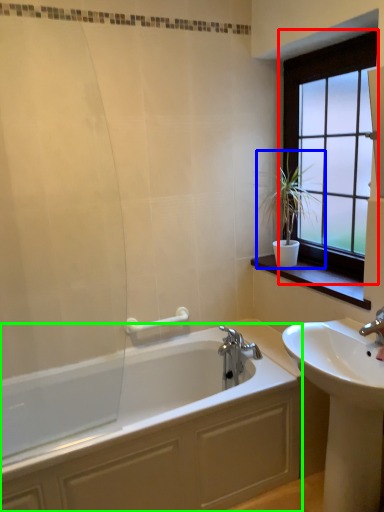
Question: Considering the real-world distances, which object is closest to window (highlighted by a red box)? houseplant (highlighted by a blue box) or bathtub (highlighted by a green box).

Choices:
 (A) houseplant
 (B) bathtub

Answer: (A)